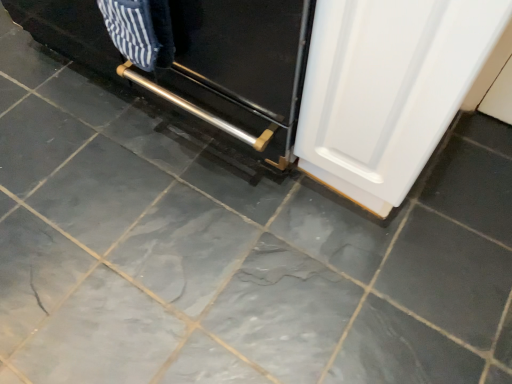
Identify the location of white glossy door at lower right. (388, 89).

What do you see at coordinates (388, 89) in the screenshot? I see `white glossy door at lower right` at bounding box center [388, 89].

Measure the distance between point [69,22] and camera.

A distance of 1.24 meters exists between point [69,22] and camera.

What do you see at coordinates (201, 61) in the screenshot? This screenshot has height=384, width=512. I see `metallic silver oven at center` at bounding box center [201, 61].

Where is `metallic silver oven at center`? The image size is (512, 384). metallic silver oven at center is located at coordinates (201, 61).

Image resolution: width=512 pixels, height=384 pixels. In order to click on white glossy door at lower right in this screenshot , I will do `click(388, 89)`.

Considering the relative positions of metallic silver oven at center and white glossy door at lower right in the image provided, is metallic silver oven at center to the left of white glossy door at lower right from the viewer's perspective?

Yes.

Between metallic silver oven at center and white glossy door at lower right, which one is positioned in front?

white glossy door at lower right is in front.

Is point (254, 154) positioned in front of point (315, 150)?

No, it is behind (315, 150).

From the image's perspective, which one is positioned higher, metallic silver oven at center or white glossy door at lower right?

metallic silver oven at center appears higher in the image.

From the picture: From a real-world perspective, which object rests below the other?

metallic silver oven at center, from a real-world perspective.

Consider the image. Which of these two, metallic silver oven at center or white glossy door at lower right, is thinner?

With smaller width is white glossy door at lower right.

Considering the sizes of objects metallic silver oven at center and white glossy door at lower right in the image provided, who is taller, metallic silver oven at center or white glossy door at lower right?

With more height is white glossy door at lower right.

Can you confirm if metallic silver oven at center is smaller than white glossy door at lower right?

No, metallic silver oven at center is not smaller than white glossy door at lower right.

Is metallic silver oven at center spatially inside white glossy door at lower right, or outside of it?

metallic silver oven at center is not inside white glossy door at lower right, it's outside.

Is metallic silver oven at center touching white glossy door at lower right?

No.

Could you tell me if metallic silver oven at center is facing white glossy door at lower right?

No, metallic silver oven at center does not turn towards white glossy door at lower right.

Consider the image. How many degrees apart are the facing directions of metallic silver oven at center and white glossy door at lower right?

0.3 degrees.

How much distance is there between metallic silver oven at center and white glossy door at lower right?

metallic silver oven at center and white glossy door at lower right are 9.68 inches apart from each other.

The height and width of the screenshot is (384, 512). In the image, there is a white glossy door at lower right. What are the coordinates of `oven below it (from a real-world perspective)` in the screenshot? It's located at (201, 61).

In the scene shown: Which is more to the left, white glossy door at lower right or metallic silver oven at center?

metallic silver oven at center.

Is white glossy door at lower right closer to camera compared to metallic silver oven at center?

Yes, white glossy door at lower right is closer to the camera.

Between point (459, 90) and point (204, 89), which one is positioned behind?

The point (204, 89) is farther from the camera.

From the image's perspective, is white glossy door at lower right over metallic silver oven at center?

No.

From a real-world perspective, is white glossy door at lower right on top of metallic silver oven at center?

Correct, in the physical world, white glossy door at lower right is higher than metallic silver oven at center.

In the scene shown: Which object is wider, white glossy door at lower right or metallic silver oven at center?

metallic silver oven at center.

Looking at this image, is white glossy door at lower right taller than metallic silver oven at center?

Yes.

Considering the sizes of objects white glossy door at lower right and metallic silver oven at center in the image provided, who is bigger, white glossy door at lower right or metallic silver oven at center?

metallic silver oven at center.

Choose the correct answer: Is white glossy door at lower right inside metallic silver oven at center or outside it?

The correct answer is: outside.

Is white glossy door at lower right beside metallic silver oven at center?

white glossy door at lower right is not next to metallic silver oven at center, and they're not touching.

Is white glossy door at lower right facing towards metallic silver oven at center?

No, white glossy door at lower right does not turn towards metallic silver oven at center.

What's the angular difference between white glossy door at lower right and metallic silver oven at center's facing directions?

The angle between the facing direction of white glossy door at lower right and the facing direction of metallic silver oven at center is 0.3 degrees.

How distant is white glossy door at lower right from metallic silver oven at center?

white glossy door at lower right is 9.68 inches away from metallic silver oven at center.

This screenshot has width=512, height=384. Find the location of `oven behind the white glossy door at lower right`. oven behind the white glossy door at lower right is located at coordinates (201, 61).

This screenshot has width=512, height=384. Find the location of `oven directly beneath the white glossy door at lower right (from a real-world perspective)`. oven directly beneath the white glossy door at lower right (from a real-world perspective) is located at coordinates (201, 61).

Find the location of `oven on the left side of white glossy door at lower right`. oven on the left side of white glossy door at lower right is located at coordinates (201, 61).